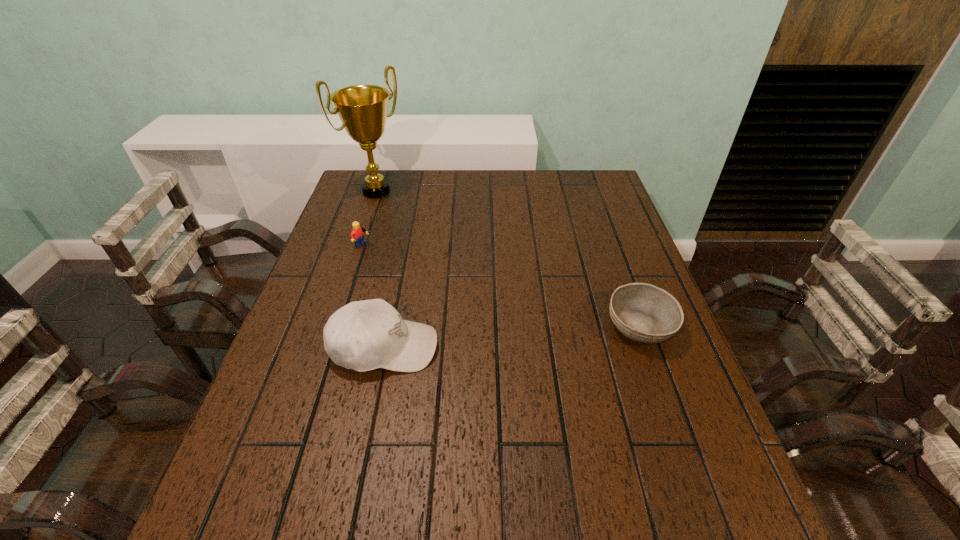
Locate an element on the screen. unoccupied area between the Lego and the shortest object is located at coordinates (503, 286).

The height and width of the screenshot is (540, 960). What are the coordinates of `free space between the shortest object and the Lego` in the screenshot? It's located at (503, 286).

Where is `vacant area between the Lego and the baseball cap`? This screenshot has width=960, height=540. vacant area between the Lego and the baseball cap is located at coordinates (x=375, y=296).

Where is `the closest object to the farthest object`? This screenshot has width=960, height=540. the closest object to the farthest object is located at coordinates (357, 235).

Where is `object that stands as the second closest to the second farthest object`? The width and height of the screenshot is (960, 540). object that stands as the second closest to the second farthest object is located at coordinates (365, 335).

The image size is (960, 540). I want to click on vacant area in the image that satisfies the following two spatial constraints: 1. on the front side of the farthest object; 2. on the front-facing side of the baseball cap, so click(x=324, y=347).

Where is `free space that satisfies the following two spatial constraints: 1. on the front side of the award; 2. on the right side of the Lego`? free space that satisfies the following two spatial constraints: 1. on the front side of the award; 2. on the right side of the Lego is located at coordinates (358, 245).